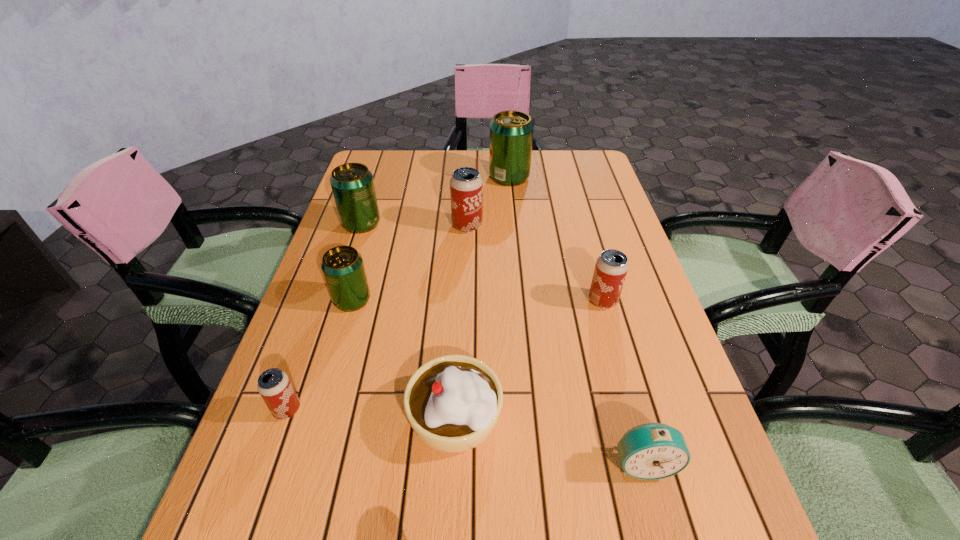
Where is `object present at the far edge`? This screenshot has width=960, height=540. object present at the far edge is located at coordinates (511, 132).

Locate an element on the screen. beer can that is at the right edge is located at coordinates (611, 267).

The height and width of the screenshot is (540, 960). In order to click on alarm clock that is at the right edge in this screenshot , I will do tap(651, 451).

Locate an element on the screen. This screenshot has width=960, height=540. vacant space at the far edge is located at coordinates (415, 156).

The height and width of the screenshot is (540, 960). Find the location of `vacant region at the left edge of the desktop`. vacant region at the left edge of the desktop is located at coordinates (391, 208).

The image size is (960, 540). In order to click on vacant space at the right edge of the desktop in this screenshot , I will do `click(598, 328)`.

Where is `vacant point at the far left corner`? This screenshot has width=960, height=540. vacant point at the far left corner is located at coordinates (379, 156).

Image resolution: width=960 pixels, height=540 pixels. Find the location of `blank space at the far right corner of the desktop`. blank space at the far right corner of the desktop is located at coordinates click(x=573, y=176).

You are a GUI agent. You are given a task and a screenshot of the screen. Output one action in this format:
    pyautogui.click(x=<x>, y=<y>)
    Task: Click on the free space between the second biggest green beer can and the blue alarm clock
    This screenshot has height=540, width=960.
    Given the screenshot: What is the action you would take?
    pyautogui.click(x=502, y=343)

Identify the location of empty location between the alarm clock and the second biggest green beer can. (502, 343).